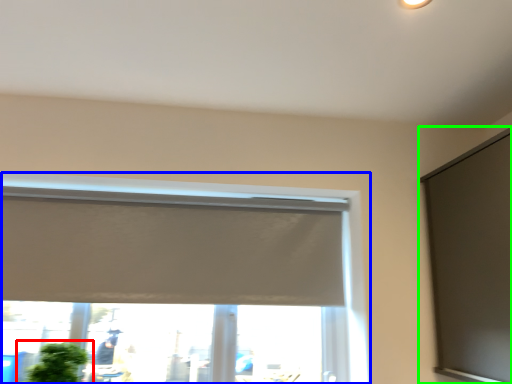
Question: Which object is the closest to the houseplant (highlighted by a red box)? Choose among these: window (highlighted by a blue box) or window screen (highlighted by a green box).

Choices:
 (A) window
 (B) window screen

Answer: (A)